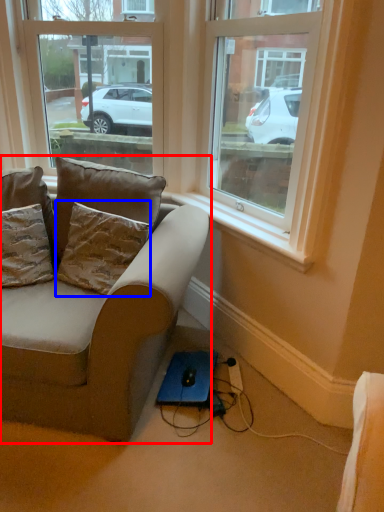
Question: Which of the following is the farthest to the observer, studio couch (highlighted by a red box) or pillow (highlighted by a blue box)?

Choices:
 (A) studio couch
 (B) pillow

Answer: (B)